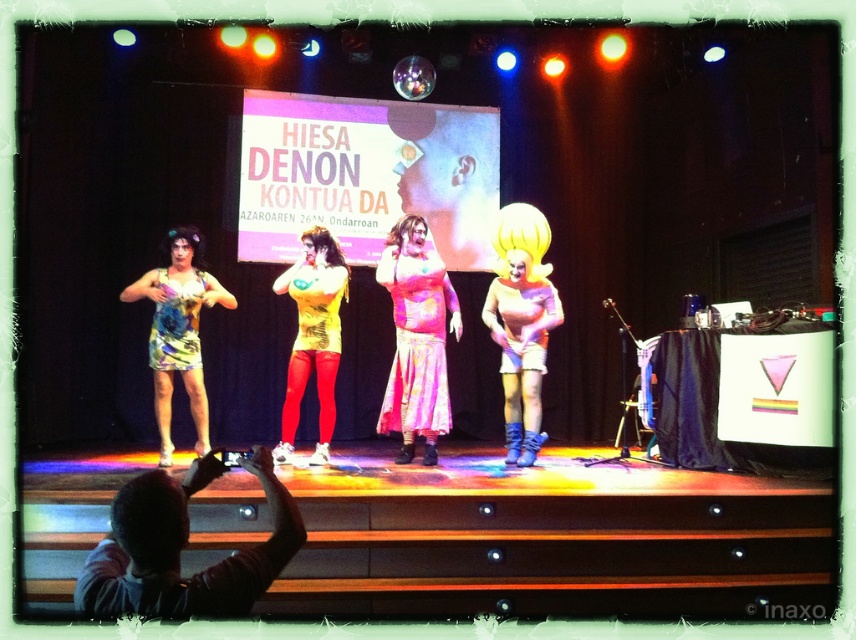
You are sitting in the audience watching the stage performance. You notice two points marked on the stage. The first point is at coordinate point [161,305] and the second is at point [557,301]. Which point appears closer to you?

Point [161,305] is closer to the viewer than point [557,301].

You are a photographer setting up for a stage performance. You need to position your camera to capture both the floral chiffon dress at center and the floral fabric dress at left in the same frame. Considering their sizes, which dress should you focus on to ensure both are visible without cropping?

The floral chiffon dress at center is larger in size than the floral fabric dress at left. To ensure both are visible, focus on the floral chiffon dress at center since it takes up more space, allowing the smaller floral fabric dress at left to fit into the frame as well.